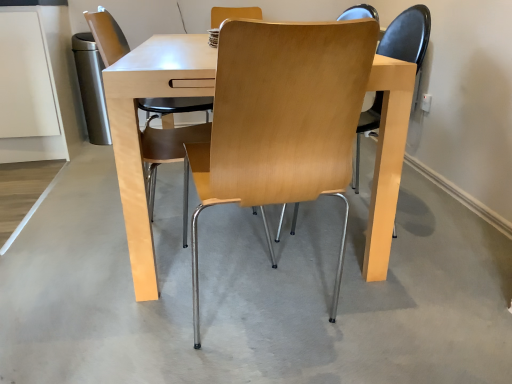
Locate an element on the screen. The image size is (512, 384). free point to the left of light wood/matte chair at center, the 1th chair from the left is located at coordinates (69, 256).